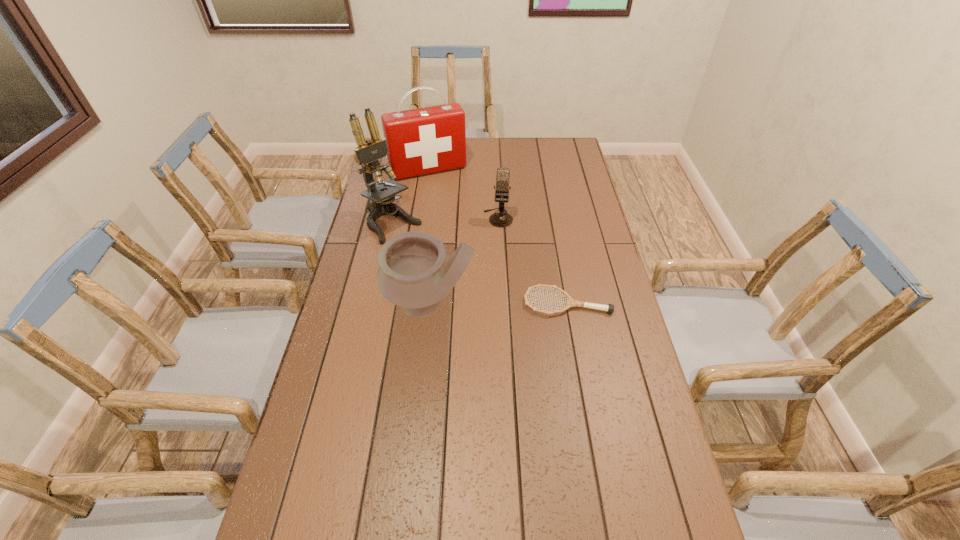
The height and width of the screenshot is (540, 960). Find the location of `the third shortest object`. the third shortest object is located at coordinates (415, 272).

This screenshot has height=540, width=960. I want to click on tennis racket, so click(609, 308).

Locate an element on the screen. The height and width of the screenshot is (540, 960). the rightmost object is located at coordinates (609, 308).

Where is `the fourth shortest object`? the fourth shortest object is located at coordinates (422, 141).

Identify the location of the farthest object. (422, 141).

I want to click on the second shortest object, so click(500, 219).

What are the coordinates of `microphone` in the screenshot? It's located at (500, 219).

Find the location of `microscope`. microscope is located at coordinates (367, 154).

Locate an element on the screen. free space located 0.150m on the left of the third tallest object is located at coordinates (337, 303).

Identify the location of vacant space located on the back of the tennis racket. (560, 260).